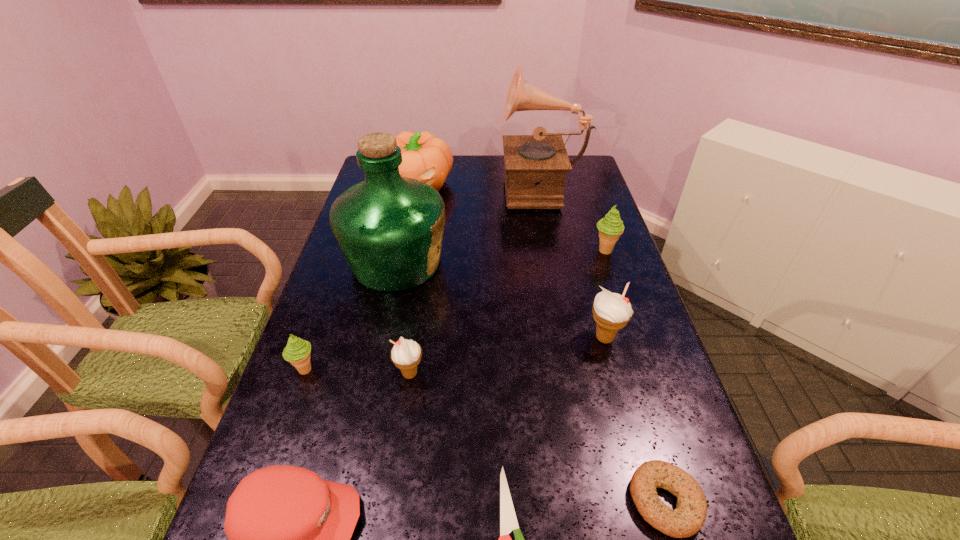
Locate an element on the screen. The image size is (960, 540). record player is located at coordinates (535, 165).

Locate an element on the screen. Image resolution: width=960 pixels, height=540 pixels. liquor is located at coordinates (389, 228).

Image resolution: width=960 pixels, height=540 pixels. In order to click on the third tallest object in this screenshot , I will do `click(426, 158)`.

At what (x,y) coordinates should I click in order to perform the action: click on the farthest icecream. Please return your answer as a coordinate pair (x, y). Image resolution: width=960 pixels, height=540 pixels. Looking at the image, I should click on (610, 227).

Identify the location of the right green icecream. Image resolution: width=960 pixels, height=540 pixels. (610, 227).

Locate an element on the screen. Image resolution: width=960 pixels, height=540 pixels. the right white icecream is located at coordinates (611, 311).

You are a GUI agent. You are given a task and a screenshot of the screen. Output one action in this format:
    pyautogui.click(x=<x>, y=<y>)
    Task: Click on the fifth farthest object
    Image resolution: width=960 pixels, height=540 pixels.
    Given the screenshot: What is the action you would take?
    pyautogui.click(x=611, y=311)

You are a GUI agent. You are given a task and a screenshot of the screen. Output one action in this format:
    pyautogui.click(x=<x>, y=<y>)
    Task: Click on the nearer white icecream
    This screenshot has width=960, height=540.
    Given the screenshot: What is the action you would take?
    pyautogui.click(x=406, y=354)

The height and width of the screenshot is (540, 960). Identify the location of the third icecream from right to left. (406, 354).

Where is `the leftmost icecream`? the leftmost icecream is located at coordinates (297, 352).